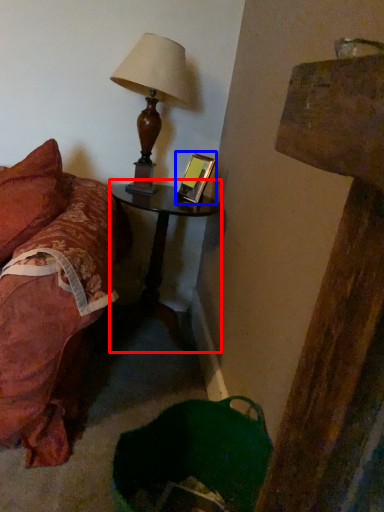
Question: Which point is further to the camera, nightstand (highlighted by a red box) or picture frame (highlighted by a blue box)?

Choices:
 (A) nightstand
 (B) picture frame

Answer: (B)